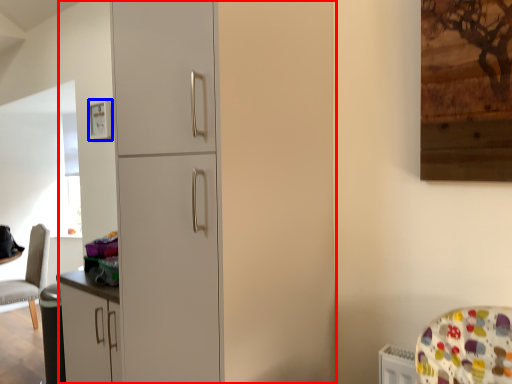
Question: Among these objects, which one is nearest to the camera, dresser (highlighted by a red box) or picture frame (highlighted by a blue box)?

Choices:
 (A) dresser
 (B) picture frame

Answer: (A)